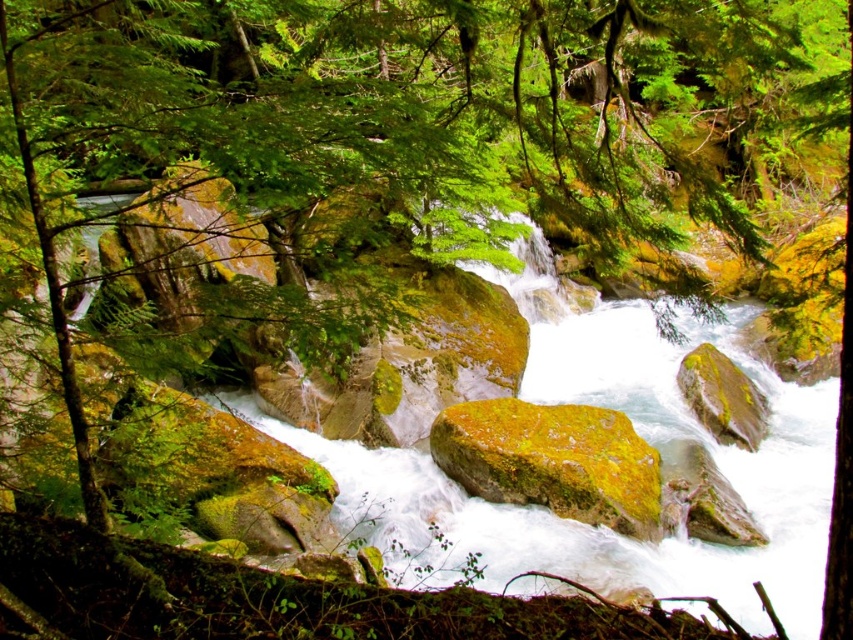
You are standing at the edge of the forested river and see a point marked at coordinates (552, 460). What object is located at that point?

The point at coordinates (552, 460) corresponds to the green mossy rock at center.